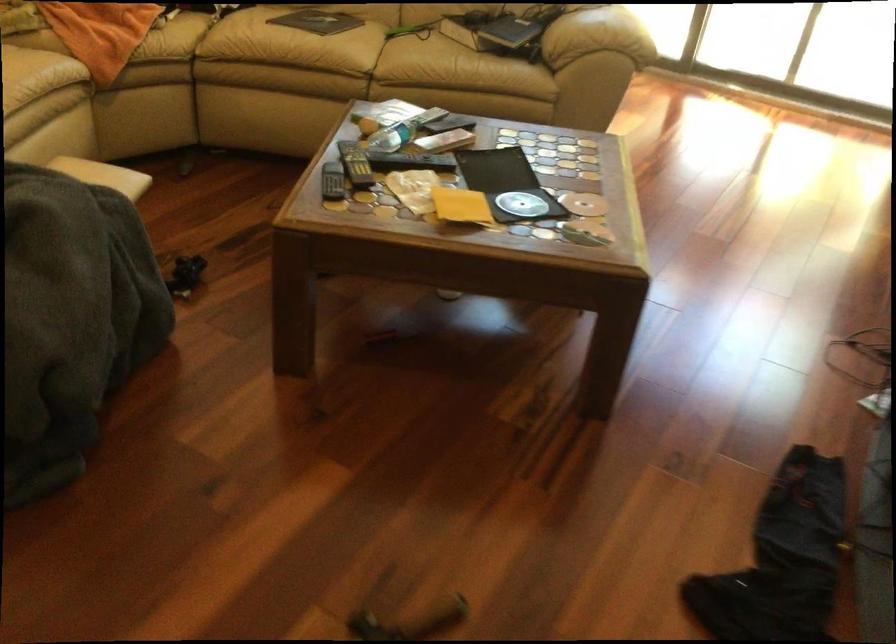
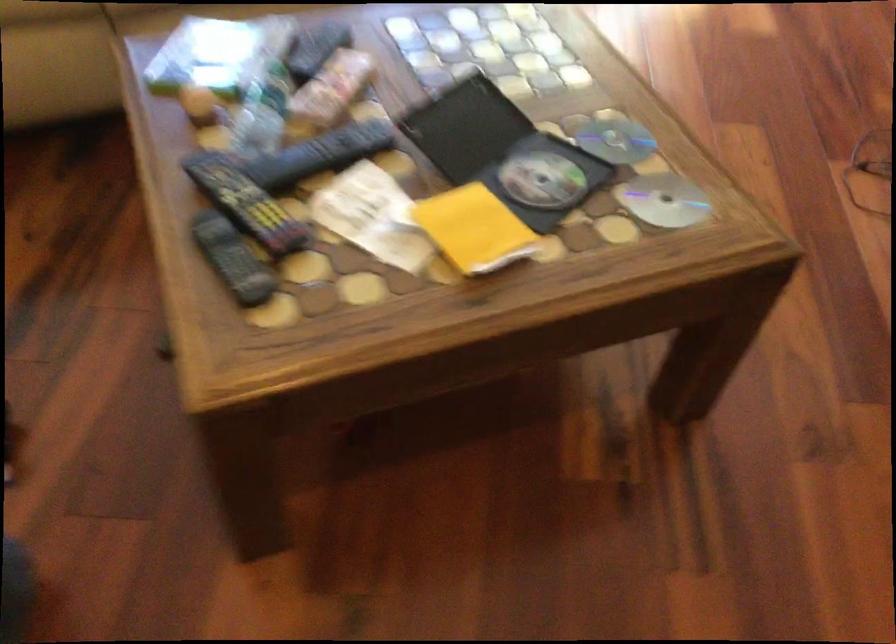
Find the pixel in the second image that matches the point at 407,158 in the first image.

(320, 154)